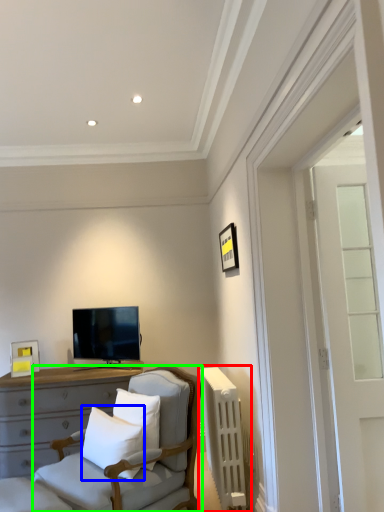
Question: Which object is positioned closest to radiator (highlighted by a red box)? Select from pillow (highlighted by a blue box) and chair (highlighted by a green box).

Choices:
 (A) pillow
 (B) chair

Answer: (B)